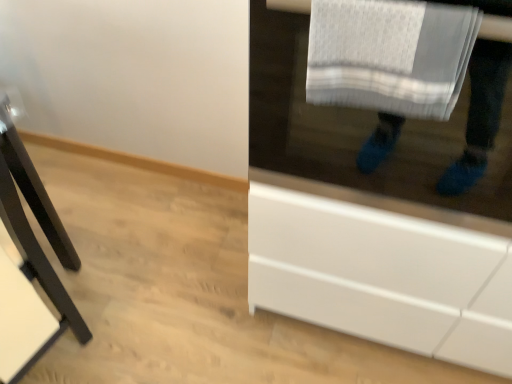
This screenshot has width=512, height=384. Identify the location of black matte table at left. (34, 235).

Describe the element at coordinates (389, 55) in the screenshot. I see `white textured towel at upper right` at that location.

Where is `black matte table at left`? The height and width of the screenshot is (384, 512). black matte table at left is located at coordinates (34, 235).

From a real-world perspective, is white glossy cabinet at lower right physically located above or below black matte table at left?

white glossy cabinet at lower right is above black matte table at left.

Does white glossy cabinet at lower right have a greater height compared to black matte table at left?

No, white glossy cabinet at lower right is not taller than black matte table at left.

Could black matte table at left be considered to be inside white glossy cabinet at lower right?

No, black matte table at left is located outside of white glossy cabinet at lower right.

Are white glossy cabinet at lower right and black matte table at left making contact?

white glossy cabinet at lower right and black matte table at left are not in contact.

In the image, there is a white textured towel at upper right. Find the location of `furniture below it (from the image's perspective)`. furniture below it (from the image's perspective) is located at coordinates (34, 235).

Would you say white textured towel at upper right is inside or outside black matte table at left?

white textured towel at upper right is located beyond the bounds of black matte table at left.

Is white textured towel at upper right oriented towards black matte table at left?

No, white textured towel at upper right is not oriented towards black matte table at left.

From the image's perspective, which object appears higher, white textured towel at upper right or black matte table at left?

white textured towel at upper right, from the image's perspective.

How many degrees apart are the facing directions of white textured towel at upper right and white glossy cabinet at lower right?

The angular difference between white textured towel at upper right and white glossy cabinet at lower right is 0.00249 degrees.

Image resolution: width=512 pixels, height=384 pixels. I want to click on cabinetry located above the white textured towel at upper right (from the image's perspective), so click(359, 140).

Considering the relative sizes of white textured towel at upper right and white glossy cabinet at lower right in the image provided, is white textured towel at upper right smaller than white glossy cabinet at lower right?

Correct, white textured towel at upper right occupies less space than white glossy cabinet at lower right.

Which object is positioned more to the right, white textured towel at upper right or white glossy cabinet at lower right?

From the viewer's perspective, white glossy cabinet at lower right appears more on the right side.

Between white glossy cabinet at lower right and white textured towel at upper right, which one has larger size?

white glossy cabinet at lower right is bigger.

Is white glossy cabinet at lower right facing away from white textured towel at upper right?

white glossy cabinet at lower right is not turned away from white textured towel at upper right.

Considering the positions of point (377, 322) and point (316, 31), is point (377, 322) closer or farther from the camera than point (316, 31)?

Point (377, 322).

Considering the positions of objects white glossy cabinet at lower right and white textured towel at upper right in the image provided, who is behind, white glossy cabinet at lower right or white textured towel at upper right?

white textured towel at upper right is further away from the camera.

Locate an element on the screen. Image resolution: width=512 pixels, height=384 pixels. cabinetry above the black matte table at left (from the image's perspective) is located at coordinates (359, 140).

Considering the points (24, 192) and (478, 267), which point is behind, point (24, 192) or point (478, 267)?

The point (24, 192) is behind.

Considering the sizes of objects black matte table at left and white glossy cabinet at lower right in the image provided, who is smaller, black matte table at left or white glossy cabinet at lower right?

Smaller between the two is black matte table at left.

Considering the relative sizes of black matte table at left and white glossy cabinet at lower right in the image provided, is black matte table at left taller than white glossy cabinet at lower right?

Yes.

How much distance is there between black matte table at left and white textured towel at upper right?

36.60 inches.

Does black matte table at left have a greater width compared to white textured towel at upper right?

Correct, the width of black matte table at left exceeds that of white textured towel at upper right.

Which is more to the left, black matte table at left or white textured towel at upper right?

black matte table at left.

Looking at this image, in the image, is black matte table at left positioned in front of or behind white textured towel at upper right?

Visually, black matte table at left is located in front of white textured towel at upper right.

At what (x,y) coordinates should I click in order to perform the action: click on cabinetry above the black matte table at left (from the image's perspective). Please return your answer as a coordinate pair (x, y). This screenshot has width=512, height=384. Looking at the image, I should click on [x=359, y=140].

This screenshot has width=512, height=384. In order to click on bath towel that appears above the black matte table at left (from a real-world perspective) in this screenshot , I will do `click(389, 55)`.

Estimate the real-world distances between objects in this image. Which object is closer to white textured towel at upper right, white glossy cabinet at lower right or black matte table at left?

The object closer to white textured towel at upper right is white glossy cabinet at lower right.

Which object lies further to the anchor point white glossy cabinet at lower right, white textured towel at upper right or black matte table at left?

black matte table at left is positioned further to the anchor white glossy cabinet at lower right.

Looking at the image, which one is located closer to white textured towel at upper right, black matte table at left or white glossy cabinet at lower right?

white glossy cabinet at lower right.

Based on the photo, considering their positions, is white textured towel at upper right positioned closer to black matte table at left than white glossy cabinet at lower right?

Among the two, white glossy cabinet at lower right is located nearer to black matte table at left.

Estimate the real-world distances between objects in this image. Which object is further from black matte table at left, white glossy cabinet at lower right or white textured towel at upper right?

The object further to black matte table at left is white textured towel at upper right.

Looking at the image, which one is located further to white glossy cabinet at lower right, black matte table at left or white textured towel at upper right?

Among the two, black matte table at left is located further to white glossy cabinet at lower right.

I want to click on bath towel between black matte table at left and white glossy cabinet at lower right, so click(x=389, y=55).